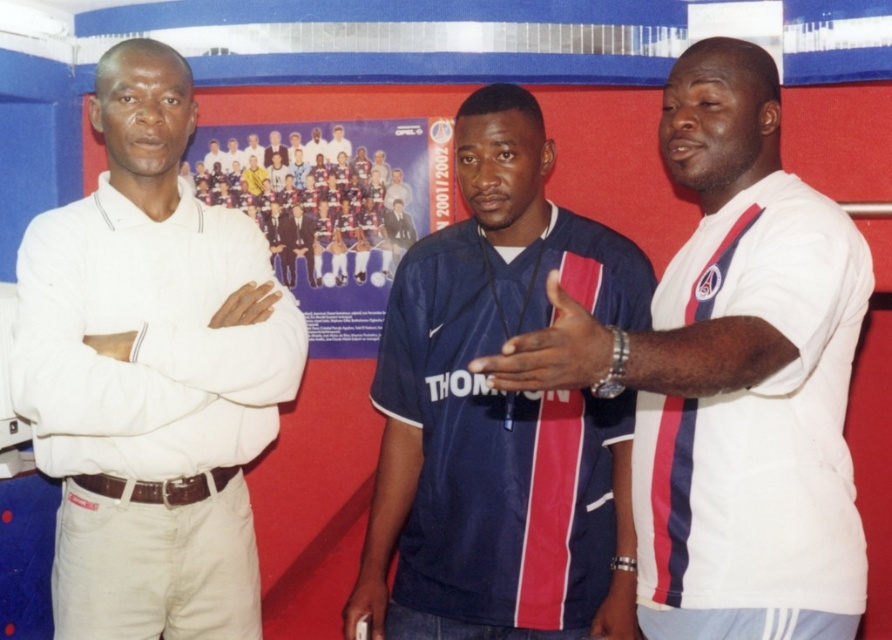
Question: Can you confirm if navy blue jersey at center is positioned below blue fabric shirt at center?

Choices:
 (A) no
 (B) yes

Answer: (A)

Question: Which of the following is the closest to the observer?

Choices:
 (A) (519, 385)
 (B) (244, 513)
 (C) (530, 353)
 (D) (217, 257)

Answer: (C)

Question: Which of the following is the closest to the observer?

Choices:
 (A) (46, 353)
 (B) (373, 324)
 (C) (233, 401)
 (D) (610, 392)

Answer: (D)

Question: Observing the image, what is the correct spatial positioning of blue fabric poster at center in reference to blue fabric shirt at center?

Choices:
 (A) right
 (B) left

Answer: (B)

Question: From the image, what is the correct spatial relationship of white cotton shirt at left in relation to white matte wristband at center?

Choices:
 (A) above
 (B) below

Answer: (B)

Question: Which object is farther from the camera taking this photo?

Choices:
 (A) white cotton shirt at left
 (B) blue fabric shirt at center
 (C) white striped shirt at right

Answer: (B)